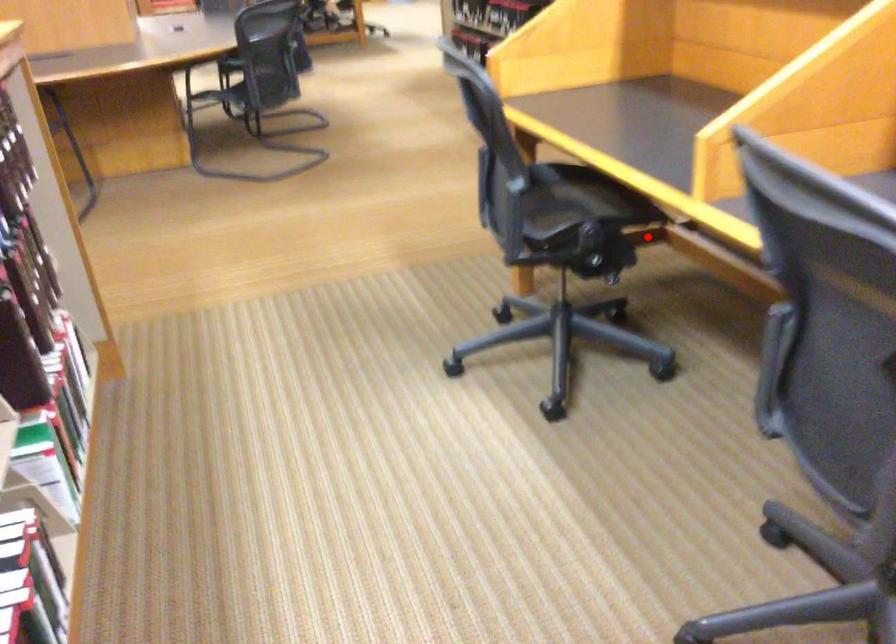
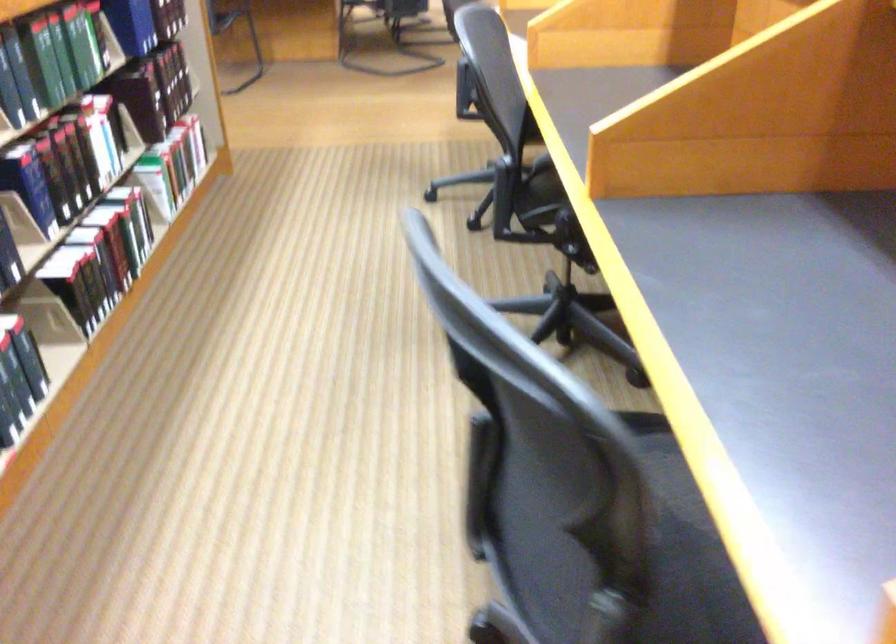
Question: I am providing you with two images of the same scene from different viewpoints. A red point is marked on the first image. Is the red point's position out of view in image 2?

Choices:
 (A) Yes
 (B) No

Answer: (A)